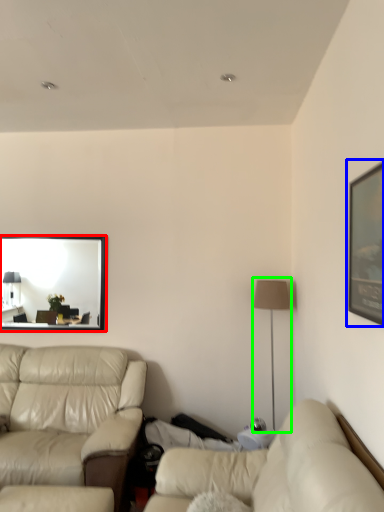
Question: Estimate the real-world distances between objects in this image. Which object is closer to mirror (highlighted by a red box), picture frame (highlighted by a blue box) or table lamp (highlighted by a green box)?

Choices:
 (A) picture frame
 (B) table lamp

Answer: (B)